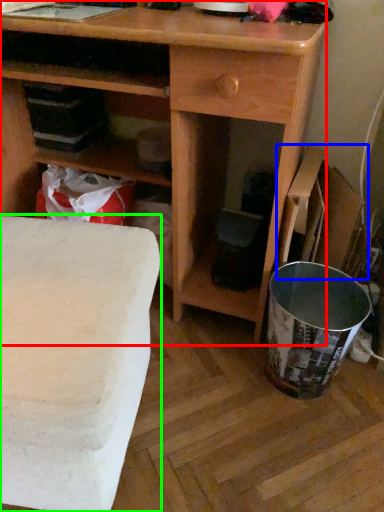
Question: Based on their relative distances, which object is nearer to desk (highlighted by a red box)? Choose from cardboard box (highlighted by a blue box) and table (highlighted by a green box).

Choices:
 (A) cardboard box
 (B) table

Answer: (A)